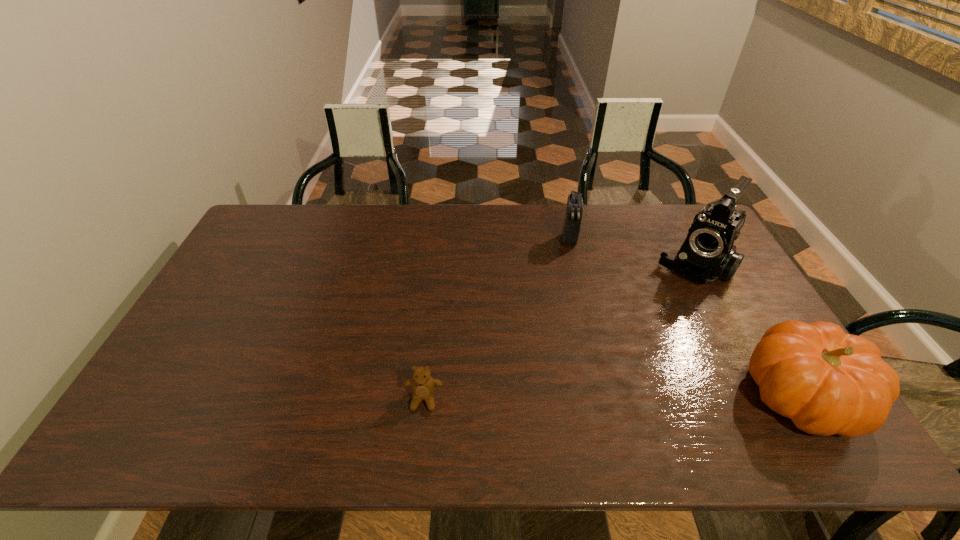
Where is `free region at the near edge of the desktop`? Image resolution: width=960 pixels, height=540 pixels. free region at the near edge of the desktop is located at coordinates 223,381.

Where is `vacant space at the left edge of the desktop`? This screenshot has height=540, width=960. vacant space at the left edge of the desktop is located at coordinates (268, 282).

You are a GUI agent. You are given a task and a screenshot of the screen. Output one action in this format:
    pyautogui.click(x=<x>, y=<y>)
    Task: Click on the free spot between the pumpkin and the third object from right to left
    
    Given the screenshot: What is the action you would take?
    (685, 317)

Identify the location of free point between the pumpkin and the tallest object. (748, 331).

This screenshot has height=540, width=960. Identify the location of empty space that is in between the clutch bag and the leftmost object. (496, 319).

Where is `vacant point located between the pumpkin and the third tallest object`? The image size is (960, 540). vacant point located between the pumpkin and the third tallest object is located at coordinates (685, 317).

Image resolution: width=960 pixels, height=540 pixels. Identify the location of vacant space in between the second shortest object and the pumpkin. (685, 317).

Identify the location of vacant space that's between the leftmost object and the second object from left to right. The height and width of the screenshot is (540, 960). (496, 319).

This screenshot has height=540, width=960. I want to click on vacant area between the clutch bag and the pumpkin, so click(685, 317).

Locate an element on the screen. The height and width of the screenshot is (540, 960). vacant area that lies between the second shortest object and the camcorder is located at coordinates (631, 253).